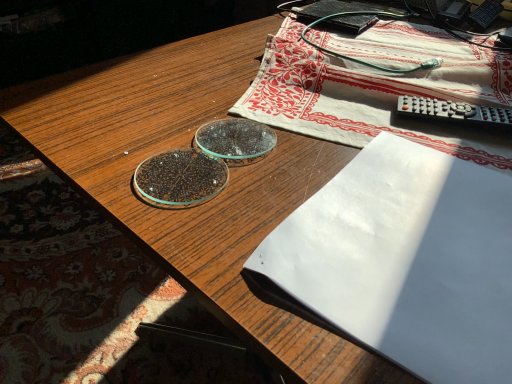
Where is `vacant area situated to the left side of black matte paperback book at upper right`? vacant area situated to the left side of black matte paperback book at upper right is located at coordinates (254, 31).